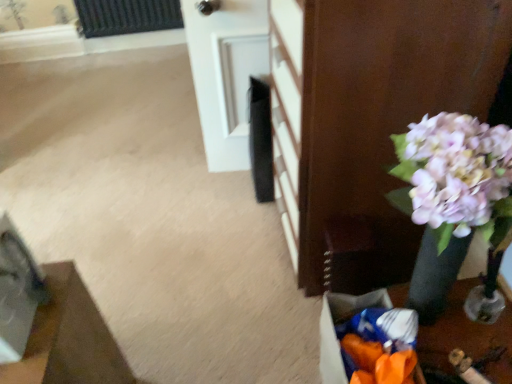
Question: Does wooden floor mat at lower left, the second furniture in the right-to-left sequence, contain matte black vase at right, which appears as the first furniture when viewed from the right?

Choices:
 (A) yes
 (B) no

Answer: (B)

Question: Does wooden floor mat at lower left, arranged as the 1th furniture when viewed from the left, appear on the right side of matte black vase at right, marked as the 2th furniture in a left-to-right arrangement?

Choices:
 (A) no
 (B) yes

Answer: (A)

Question: Is wooden floor mat at lower left, the second furniture in the right-to-left sequence, smaller than matte black vase at right, positioned as the 1th furniture in top-to-bottom order?

Choices:
 (A) no
 (B) yes

Answer: (B)

Question: Is the position of wooden floor mat at lower left, which is the first furniture in bottom-to-top order, more distant than that of matte black vase at right, positioned as the 1th furniture in top-to-bottom order?

Choices:
 (A) no
 (B) yes

Answer: (A)

Question: Is wooden floor mat at lower left, the second furniture in the right-to-left sequence, taller than matte black vase at right, which appears as the second furniture when ordered from the bottom?

Choices:
 (A) no
 (B) yes

Answer: (A)

Question: Is wooden floor mat at lower left, which is the first furniture in bottom-to-top order, bigger than matte black vase at right, which appears as the second furniture when ordered from the bottom?

Choices:
 (A) yes
 (B) no

Answer: (B)

Question: Does white glossy door at upper center have a greater width compared to orange plastic bag at lower right?

Choices:
 (A) no
 (B) yes

Answer: (B)

Question: From a real-world perspective, is white glossy door at upper center positioned over orange plastic bag at lower right based on gravity?

Choices:
 (A) yes
 (B) no

Answer: (A)

Question: Considering the relative sizes of white glossy door at upper center and orange plastic bag at lower right in the image provided, is white glossy door at upper center taller than orange plastic bag at lower right?

Choices:
 (A) yes
 (B) no

Answer: (A)

Question: Is orange plastic bag at lower right a part of white glossy door at upper center?

Choices:
 (A) yes
 (B) no

Answer: (B)

Question: Could you tell me if white glossy door at upper center is facing orange plastic bag at lower right?

Choices:
 (A) yes
 (B) no

Answer: (A)

Question: From the image's perspective, is white glossy door at upper center over orange plastic bag at lower right?

Choices:
 (A) yes
 (B) no

Answer: (A)

Question: Does wooden floor mat at lower left, which is the first furniture in bottom-to-top order, have a greater height compared to white glossy door at upper center?

Choices:
 (A) yes
 (B) no

Answer: (B)